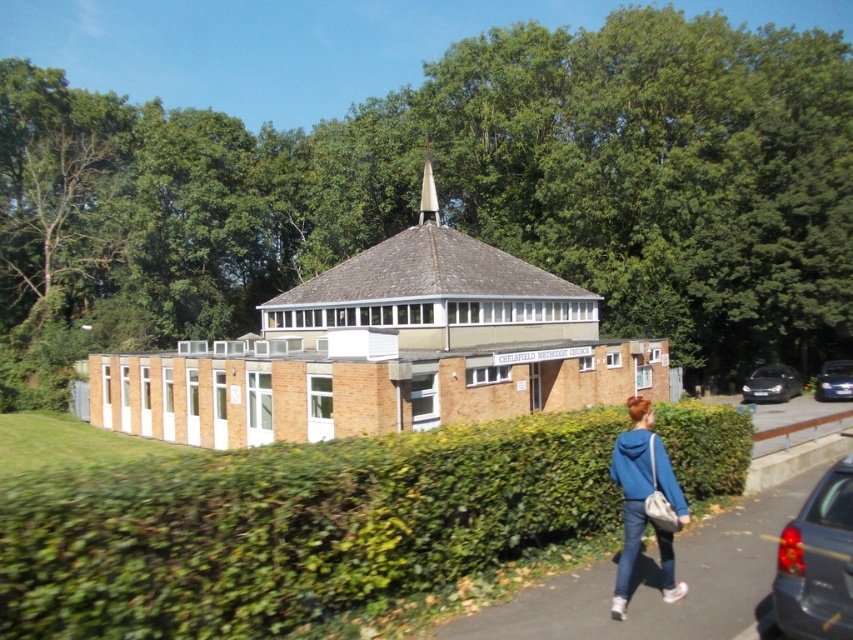
You are standing at the camera position and want to take a photo of the metallic silver car at right. The camera has a maximum range of 100 feet. Can you capture the car in your photo?

The metallic silver car at right and camera are 99.44 feet apart from each other, so yes, the camera can capture the car in the photo since the distance is within its 100 feet range.

You are standing in front of the Chelsfield Methodist Church and see a blue fleece jacket at lower right. Where exactly is the blue fleece jacket located in the image?

The blue fleece jacket at lower right is located at the 2D coordinates point (639,490) in the image.